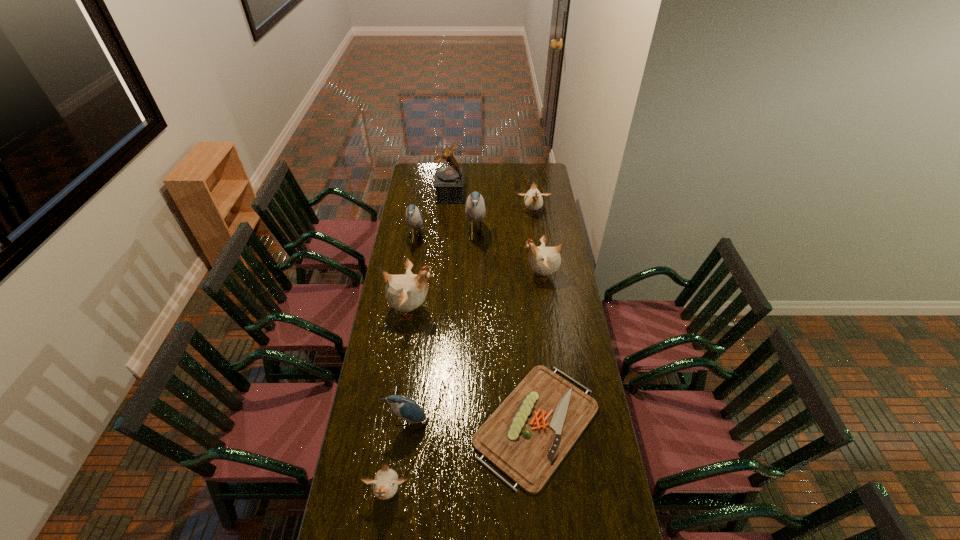
This screenshot has height=540, width=960. I want to click on the smallest white bird, so click(385, 484).

In order to click on chopping board in this screenshot , I will do `click(529, 434)`.

Locate an element on the screen. vacant space located at the horn opening of the farthest object is located at coordinates click(x=521, y=194).

Locate an element on the screen. vacant area situated 0.150m at the tip of the third bird from right to left's beak is located at coordinates (513, 235).

You are a GUI agent. You are given a task and a screenshot of the screen. Output one action in this format:
    pyautogui.click(x=<x>, y=<y>)
    Task: Click on the vacant space situated 0.340m at the beak of the biggest white bird
    
    Given the screenshot: What is the action you would take?
    pyautogui.click(x=510, y=309)

Where is `vacant space positioned 0.390m at the tip of the second smallest blue bird's beak`? vacant space positioned 0.390m at the tip of the second smallest blue bird's beak is located at coordinates pyautogui.click(x=495, y=239).

Locate an element on the screen. free space located at the beak of the third smallest white bird is located at coordinates (444, 275).

At what (x,y) coordinates should I click in order to perform the action: click on vacant space situated 0.160m at the beak of the third smallest white bird. Please return your answer as a coordinate pair (x, y). Looking at the image, I should click on (490, 275).

At what (x,y) coordinates should I click in order to perform the action: click on vacant space located at the beak of the third smallest white bird. Please return your answer as a coordinate pair (x, y). Looking at the image, I should click on (493, 275).

This screenshot has height=540, width=960. In order to click on vacant space situated at the beak of the farthest white bird in this screenshot , I will do `click(538, 246)`.